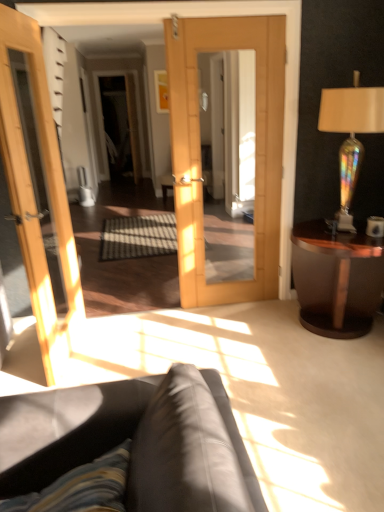
Question: From the image's perspective, does mahogany wood side table at right appear lower than matte white cup at right?

Choices:
 (A) no
 (B) yes

Answer: (B)

Question: Is mahogany wood side table at right completely or partially outside of matte white cup at right?

Choices:
 (A) no
 (B) yes

Answer: (B)

Question: Are mahogany wood side table at right and matte white cup at right located far from each other?

Choices:
 (A) no
 (B) yes

Answer: (A)

Question: Does mahogany wood side table at right have a greater width compared to matte white cup at right?

Choices:
 (A) no
 (B) yes

Answer: (B)

Question: Considering the relative sizes of mahogany wood side table at right and matte white cup at right in the image provided, is mahogany wood side table at right smaller than matte white cup at right?

Choices:
 (A) yes
 (B) no

Answer: (B)

Question: In the image, is leather couch at lower center positioned in front of or behind mahogany wood side table at right?

Choices:
 (A) behind
 (B) front

Answer: (B)

Question: In the image, is leather couch at lower center on the left side or the right side of mahogany wood side table at right?

Choices:
 (A) left
 (B) right

Answer: (A)

Question: Based on their sizes in the image, would you say leather couch at lower center is bigger or smaller than mahogany wood side table at right?

Choices:
 (A) small
 (B) big

Answer: (B)

Question: Considering the positions of point (231, 502) and point (342, 332), is point (231, 502) closer or farther from the camera than point (342, 332)?

Choices:
 (A) closer
 (B) farther

Answer: (A)

Question: Based on their positions, is iridescent glass lamp at right located to the left or right of mahogany wood side table at right?

Choices:
 (A) left
 (B) right

Answer: (B)

Question: In terms of height, does iridescent glass lamp at right look taller or shorter compared to mahogany wood side table at right?

Choices:
 (A) short
 (B) tall

Answer: (B)

Question: Relative to mahogany wood side table at right, is iridescent glass lamp at right in front or behind?

Choices:
 (A) behind
 (B) front

Answer: (B)

Question: Is iridescent glass lamp at right spatially inside mahogany wood side table at right, or outside of it?

Choices:
 (A) inside
 (B) outside

Answer: (B)

Question: Which is correct: leather couch at lower center is inside matte white cup at right, or outside of it?

Choices:
 (A) inside
 (B) outside

Answer: (B)

Question: Is leather couch at lower center wider or thinner than matte white cup at right?

Choices:
 (A) thin
 (B) wide

Answer: (B)